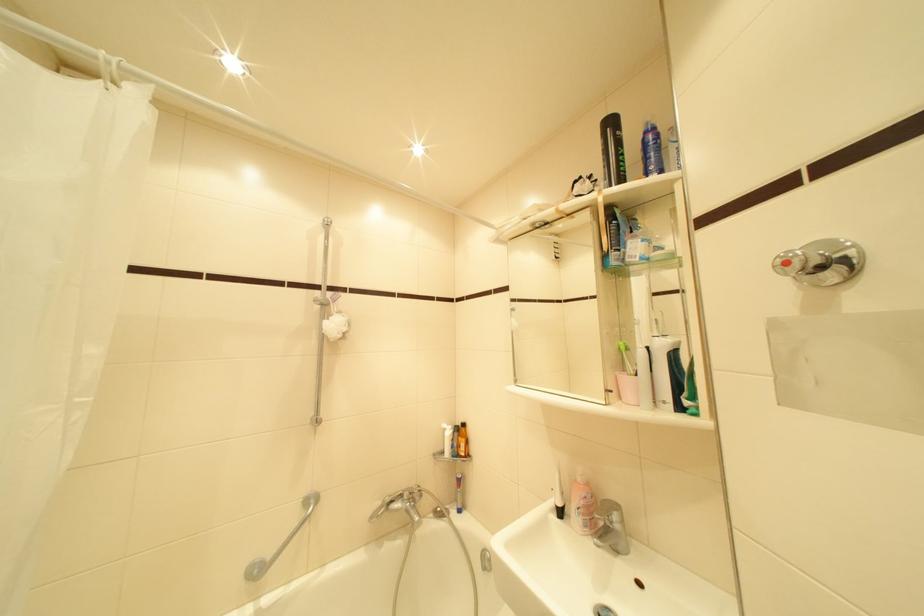
Find where to grip the shower head. Please return your answer as a coordinate pair (x, y).

(335, 235)